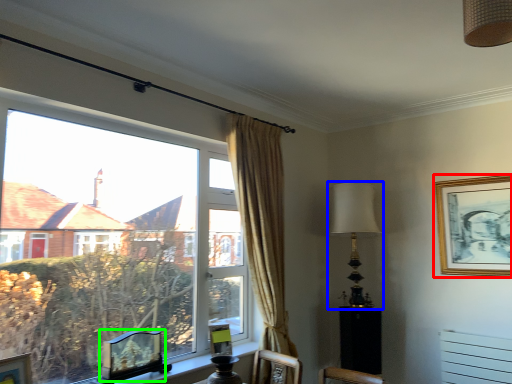
Question: Estimate the real-world distances between objects in this image. Which object is farther from picture frame (highlighted by a red box), table lamp (highlighted by a blue box) or picture frame (highlighted by a green box)?

Choices:
 (A) table lamp
 (B) picture frame

Answer: (B)